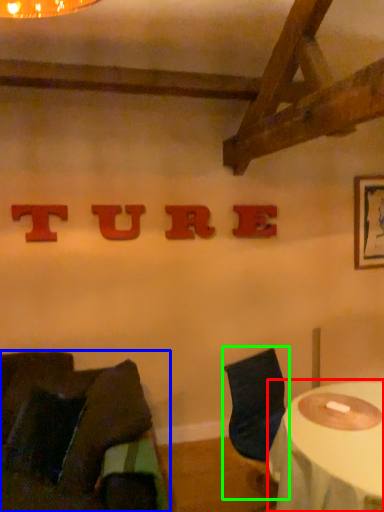
Question: Which object is positioned farthest from table (highlighted by a red box)? Select from chair (highlighted by a blue box) and chair (highlighted by a green box).

Choices:
 (A) chair
 (B) chair

Answer: (A)